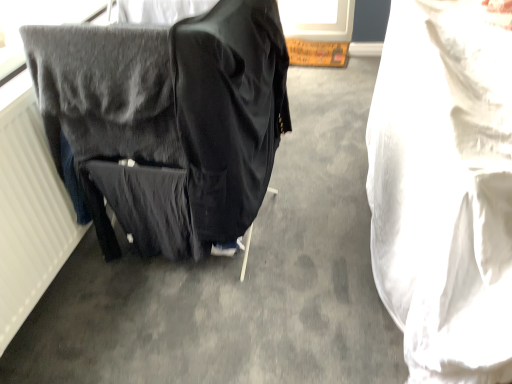
Question: Is white fabric at right shorter than black fabric bag at left?

Choices:
 (A) yes
 (B) no

Answer: (A)

Question: Is white fabric at right behind black fabric bag at left?

Choices:
 (A) no
 (B) yes

Answer: (A)

Question: Is white fabric at right oriented towards black fabric bag at left?

Choices:
 (A) no
 (B) yes

Answer: (A)

Question: Can you see white fabric at right touching black fabric bag at left?

Choices:
 (A) no
 (B) yes

Answer: (A)

Question: Is white fabric at right to the right of black fabric bag at left from the viewer's perspective?

Choices:
 (A) yes
 (B) no

Answer: (A)

Question: Is white fabric at right far away from black fabric bag at left?

Choices:
 (A) yes
 (B) no

Answer: (B)

Question: Can you confirm if black fabric bag at left is taller than white fabric at right?

Choices:
 (A) no
 (B) yes

Answer: (B)

Question: Is black fabric bag at left smaller than white fabric at right?

Choices:
 (A) yes
 (B) no

Answer: (A)

Question: Would you say black fabric bag at left is outside white fabric at right?

Choices:
 (A) yes
 (B) no

Answer: (A)

Question: Does black fabric bag at left have a larger size compared to white fabric at right?

Choices:
 (A) yes
 (B) no

Answer: (B)

Question: Is black fabric bag at left oriented towards white fabric at right?

Choices:
 (A) no
 (B) yes

Answer: (B)

Question: From a real-world perspective, is black fabric bag at left positioned over white fabric at right based on gravity?

Choices:
 (A) no
 (B) yes

Answer: (B)

Question: In terms of width, does black fabric bag at left look wider or thinner when compared to white fabric at right?

Choices:
 (A) wide
 (B) thin

Answer: (B)